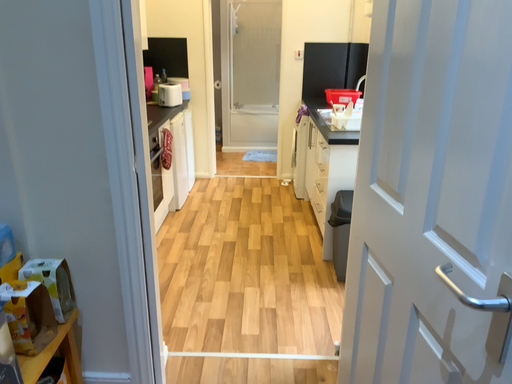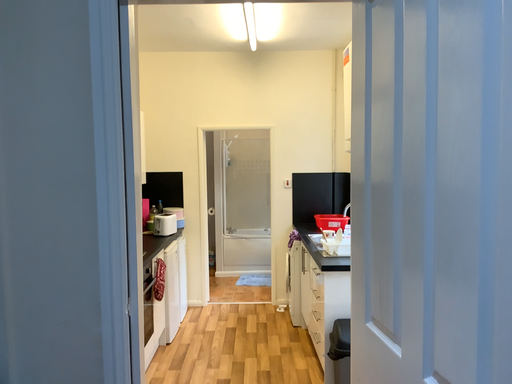
Question: How did the camera likely rotate when shooting the video?

Choices:
 (A) rotated upward
 (B) rotated downward

Answer: (A)